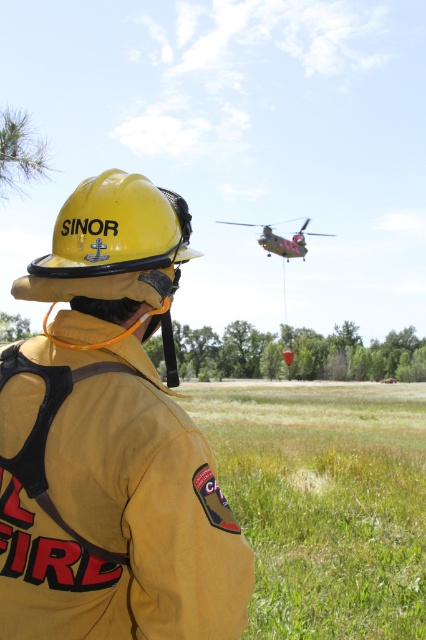
Does green grass at center have a greater width compared to yellow matte helmet at center?

Yes.

Does green grass at center have a smaller size compared to yellow matte helmet at center?

No, green grass at center is not smaller than yellow matte helmet at center.

Where is `green grass at center`? The height and width of the screenshot is (640, 426). green grass at center is located at coordinates (324, 500).

The image size is (426, 640). Identify the location of green grass at center. (324, 500).

Can you confirm if yellow fireman at center is positioned to the left of yellow matte helmet at center?

Yes, yellow fireman at center is to the left of yellow matte helmet at center.

How far apart are yellow fireman at center and yellow matte helmet at center?

yellow fireman at center and yellow matte helmet at center are 9.40 inches apart from each other.

Where is `yellow fireman at center`? This screenshot has height=640, width=426. yellow fireman at center is located at coordinates (111, 444).

This screenshot has width=426, height=640. Identify the location of yellow fireman at center. (111, 444).

This screenshot has width=426, height=640. What are the coordinates of `green grass at center` in the screenshot? It's located at (324, 500).

Can you confirm if green grass at center is positioned above green matte helicopter at upper center?

Actually, green grass at center is below green matte helicopter at upper center.

In order to click on green grass at center in this screenshot , I will do `click(324, 500)`.